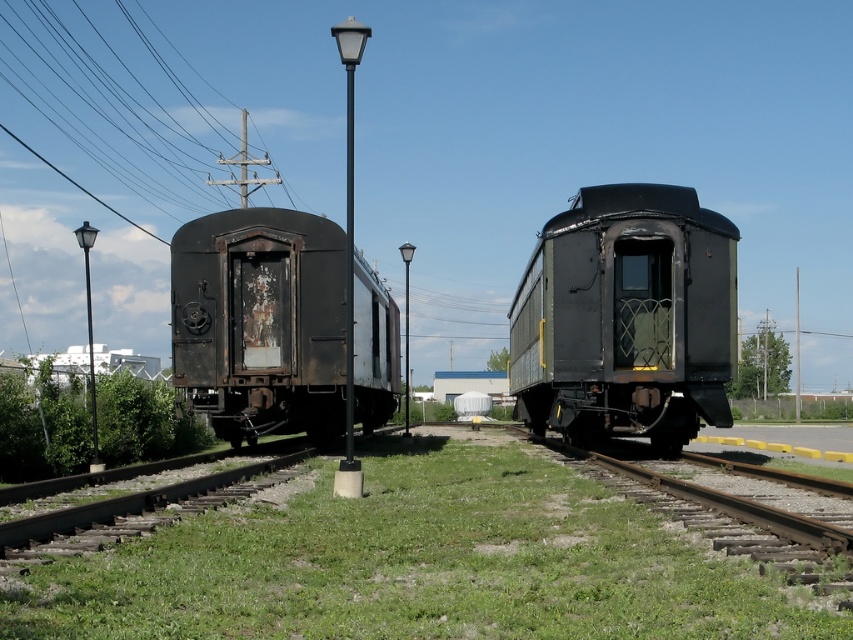
Question: Considering the relative positions of rusty metal train car at left and black metal power line at upper left in the image provided, where is rusty metal train car at left located with respect to black metal power line at upper left?

Choices:
 (A) right
 (B) left

Answer: (A)

Question: Which object appears farthest from the camera in this image?

Choices:
 (A) rusty metal train car at left
 (B) green grass at center
 (C) rusty metal train car at center

Answer: (A)

Question: Is rusty metal train car at left further to the viewer compared to black metal power line at upper left?

Choices:
 (A) no
 (B) yes

Answer: (A)

Question: Is rusty metal train car at left smaller than black metal power line at upper left?

Choices:
 (A) yes
 (B) no

Answer: (A)

Question: Based on their relative distances, which object is farther from the rusty metal train car at left?

Choices:
 (A) green grass at center
 (B) black metal power line at upper left
 (C) rusty metal train car at center

Answer: (B)

Question: Which object is farther from the camera taking this photo?

Choices:
 (A) rusty metal train car at center
 (B) black metal power line at upper left

Answer: (B)